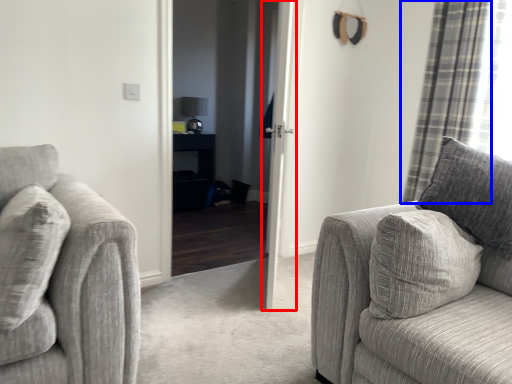
Question: Which object is closer to the camera taking this photo, door (highlighted by a red box) or curtain (highlighted by a blue box)?

Choices:
 (A) door
 (B) curtain

Answer: (A)